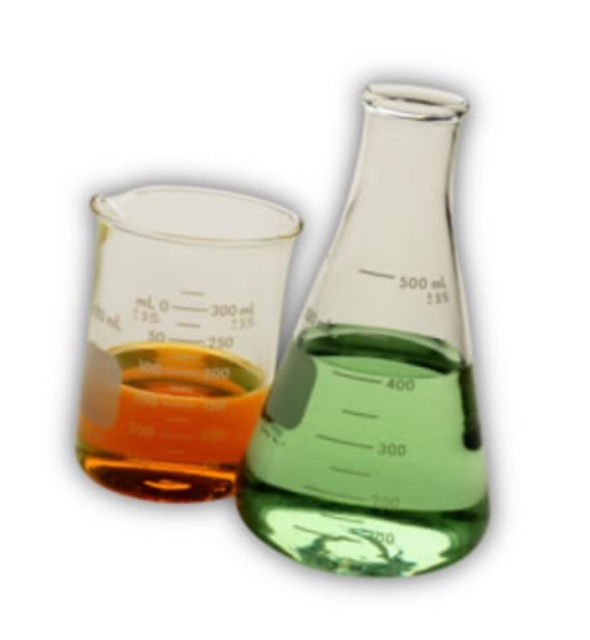
Is transparent glass beaker at center behind translucent glass beaker at left?

That is False.

Image resolution: width=590 pixels, height=640 pixels. I want to click on transparent glass beaker at center, so click(x=378, y=369).